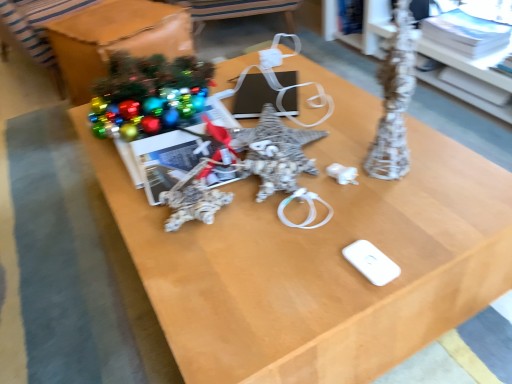
In order to click on unoccupied area behind white matte ipod at lower right in this screenshot , I will do `click(346, 209)`.